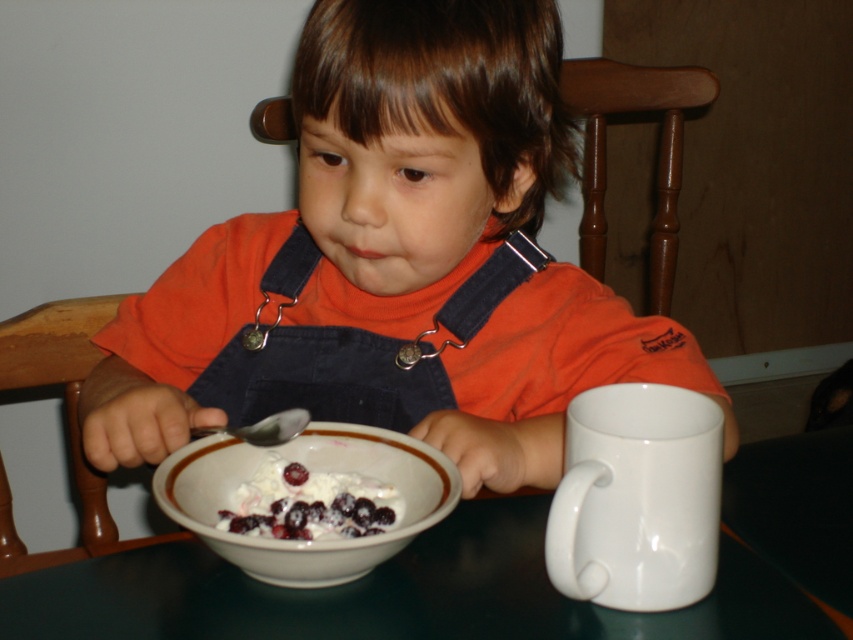
You are a parent observing your child eating. You see the orange cotton shirt at center and the smooth dark green table at center. Which object is closer to the child?

The orange cotton shirt at center is closer to the child because it is located above the smooth dark green table at center, meaning it is positioned nearer to the child who is sitting at the table.

You are a parent trying to reach for the mug on the right side of the table. Considering the positions of the orange cotton shirt at center and the smooth dark green table at center, which object is closer to you as you approach the table?

The orange cotton shirt at center is closer to you than the smooth dark green table at center, so you would reach the orange cotton shirt at center first before accessing the mug.

From the picture: You are a child sitting at the table in the image. You want to reach for the spoon in the bowl. The spoon is located at point (590, 260). However, there is a mug at point (64, 401). Which object is closer to you when you are sitting at the table?

Point (64, 401) is closer to you than point (590, 260) because the mug is in front of the spoon.